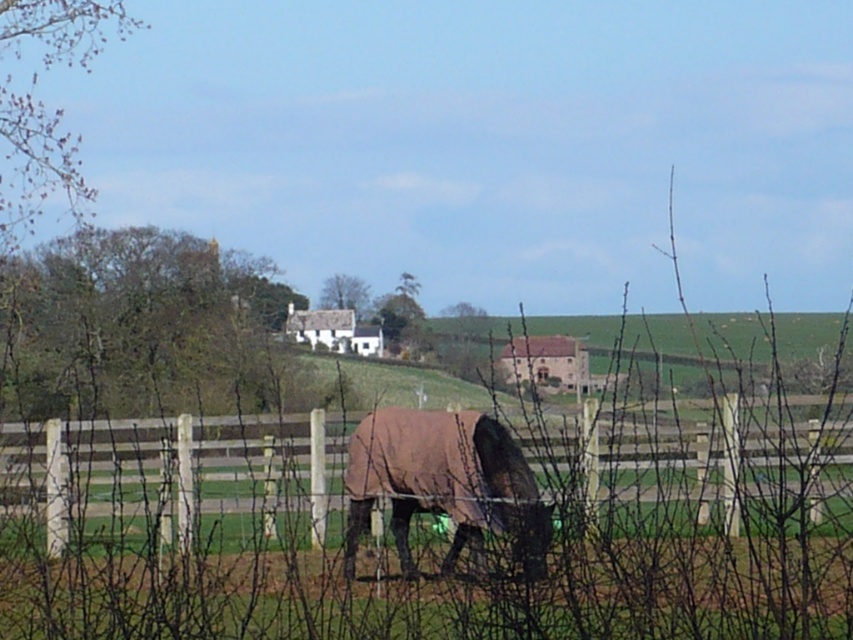
Question: Does brown wooden fence at lower center have a greater width compared to brown fuzzy horse at center?

Choices:
 (A) no
 (B) yes

Answer: (B)

Question: Which of the following is the closest to the observer?

Choices:
 (A) brown wooden fence at lower center
 (B) brown fuzzy horse at center

Answer: (A)

Question: Which of the following is the farthest from the observer?

Choices:
 (A) click(323, 424)
 (B) click(380, 452)

Answer: (A)

Question: Does brown wooden fence at lower center appear on the left side of brown fuzzy horse at center?

Choices:
 (A) no
 (B) yes

Answer: (A)

Question: Is brown wooden fence at lower center wider than brown fuzzy horse at center?

Choices:
 (A) yes
 (B) no

Answer: (A)

Question: Which object appears farthest from the camera in this image?

Choices:
 (A) brown fuzzy horse at center
 (B) brown wooden fence at lower center

Answer: (A)